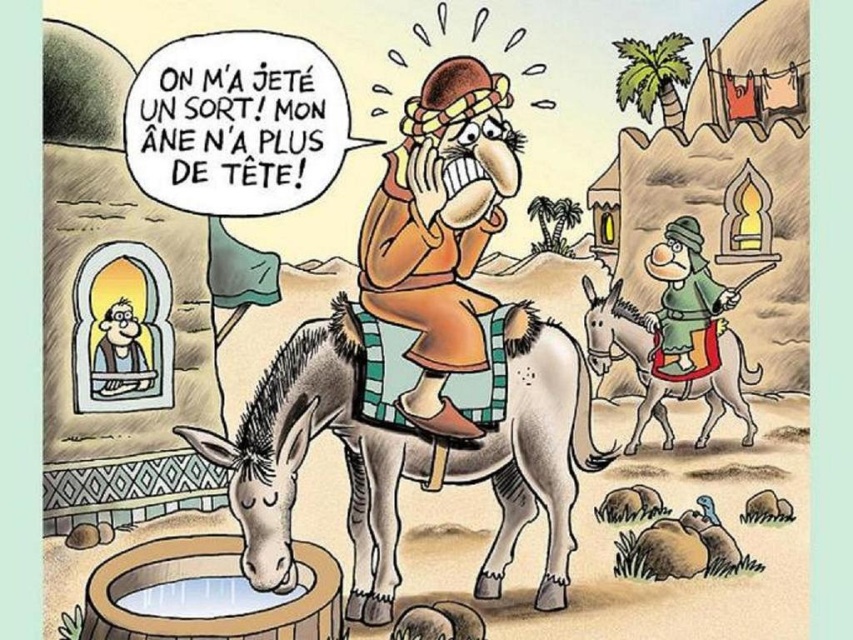
Looking at this image, you are a wizard standing in the desert scene and you need to retrieve the light blue paper scroll at upper left to break the spell. You can cast a spell to teleport 3 meters forward. Will you be able to reach the scroll?

The light blue paper scroll at upper left is 3.41 meters away from the camera. Since you can teleport 3 meters forward, you will still be 0.41 meters short of reaching the scroll.

You are a photographer standing 5 meters away from the point at coordinates point (405, 193). Can you take a clear photo of this point without moving closer?

The distance of point (405, 193) from camera is 3.59 meters. Since you are standing 5 meters away, you are further than the point, so you can take a clear photo without moving closer.

You are a traveler in the desert and see the gray matte mule at center and the smooth brown shirt at upper left. Which object is bigger in size?

The gray matte mule at center is bigger in size compared to the smooth brown shirt at upper left.